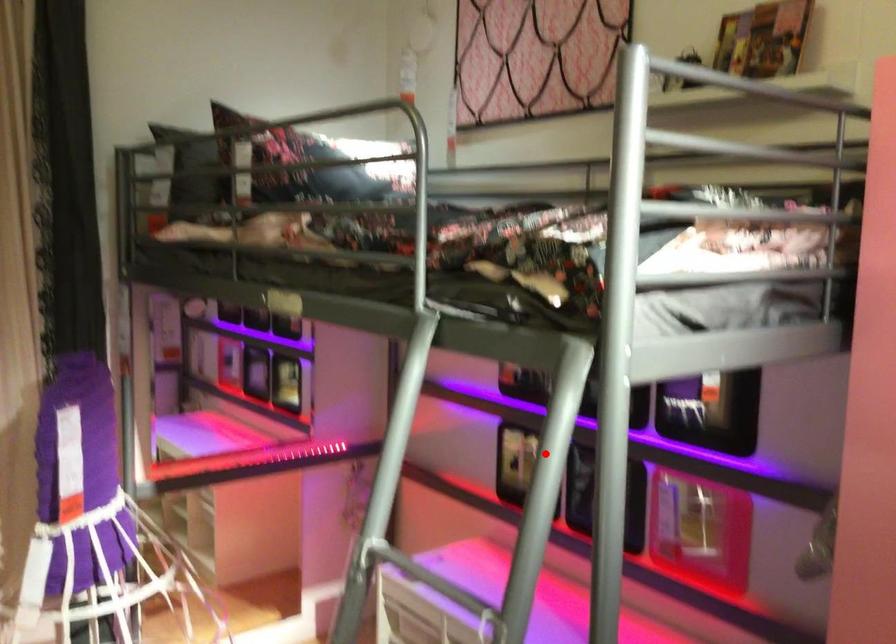
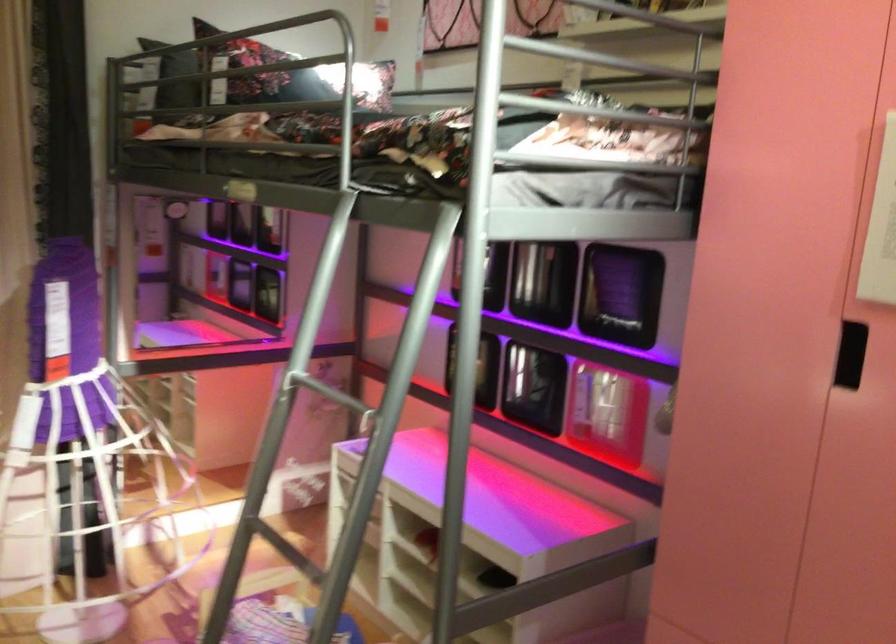
Question: I am providing you with two images of the same scene from different viewpoints. A red point is shown in image1. For the corresponding object point in image2, is it positioned nearer or farther from the camera?

Choices:
 (A) Nearer
 (B) Farther

Answer: (B)